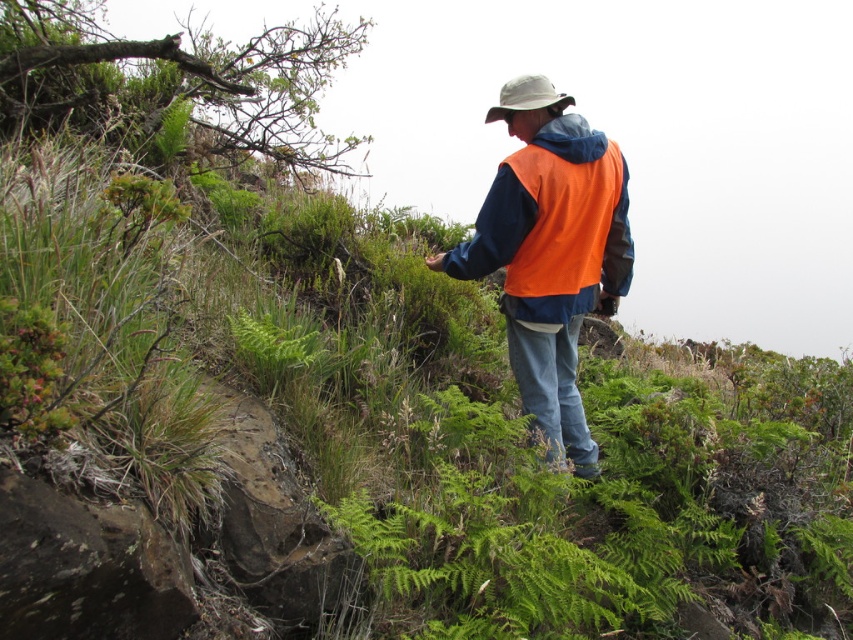
You are a hiker trying to identify the position of your gear. You have an orange fleece vest at center and a khaki fabric hat at center. Which item is nearer to you?

The orange fleece vest at center is closer to the viewer than the khaki fabric hat at center, so the orange fleece vest at center is nearer to you.

You are a hiker trying to locate your orange fleece vest at center in a hilly area. Based on the coordinates provided, can you determine if the vest is closer to the top or bottom of the image?

The orange fleece vest at center is located at point 0.394 on the x and 0.646 on the y. Since the y coordinate is 0.646, which is closer to 1, the vest is closer to the bottom of the image.